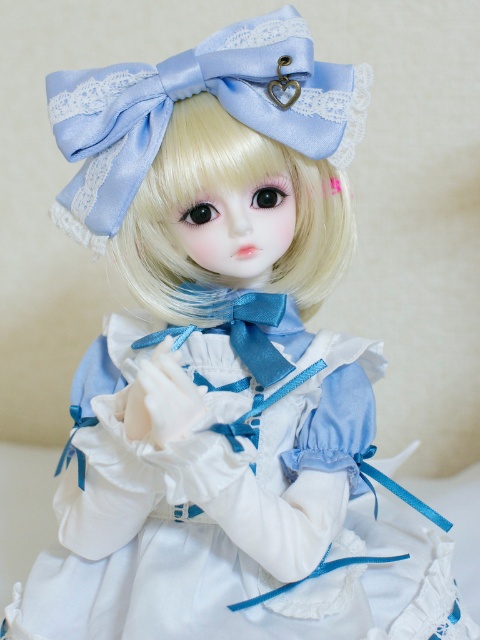
Question: Is satin/light blue bonnet at upper center to the right of matte blue ribbon at center from the viewer's perspective?

Choices:
 (A) no
 (B) yes

Answer: (A)

Question: Can you confirm if satin/light blue bonnet at upper center is wider than matte blue ribbon at center?

Choices:
 (A) yes
 (B) no

Answer: (A)

Question: Which of the following is the farthest from the observer?

Choices:
 (A) (250, 296)
 (B) (82, 115)

Answer: (A)

Question: Which point appears closest to the camera in this image?

Choices:
 (A) (192, 326)
 (B) (268, 13)

Answer: (B)

Question: Is satin/light blue bonnet at upper center below matte blue ribbon at center?

Choices:
 (A) no
 (B) yes

Answer: (A)

Question: Among these points, which one is farthest from the camera?

Choices:
 (A) (60, 124)
 (B) (268, 310)

Answer: (B)